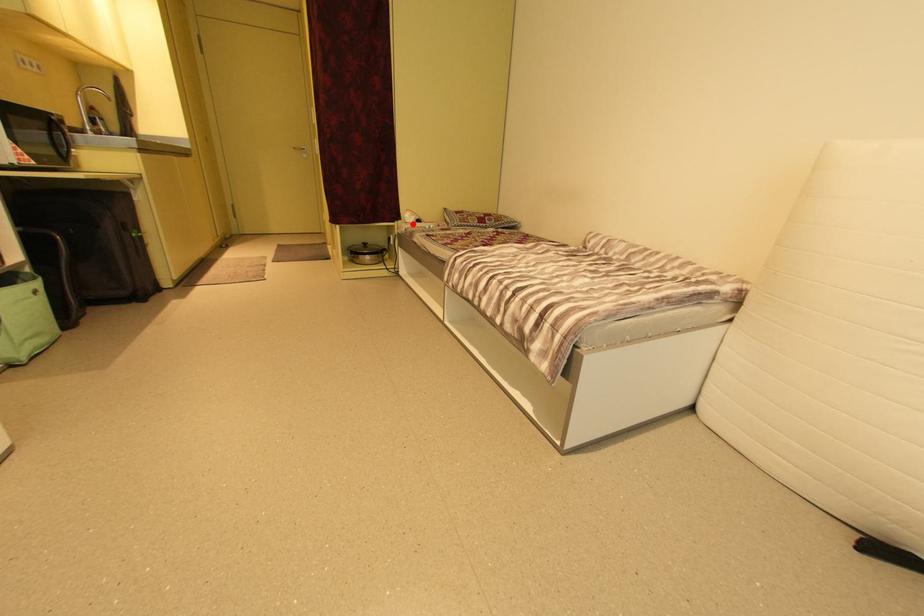
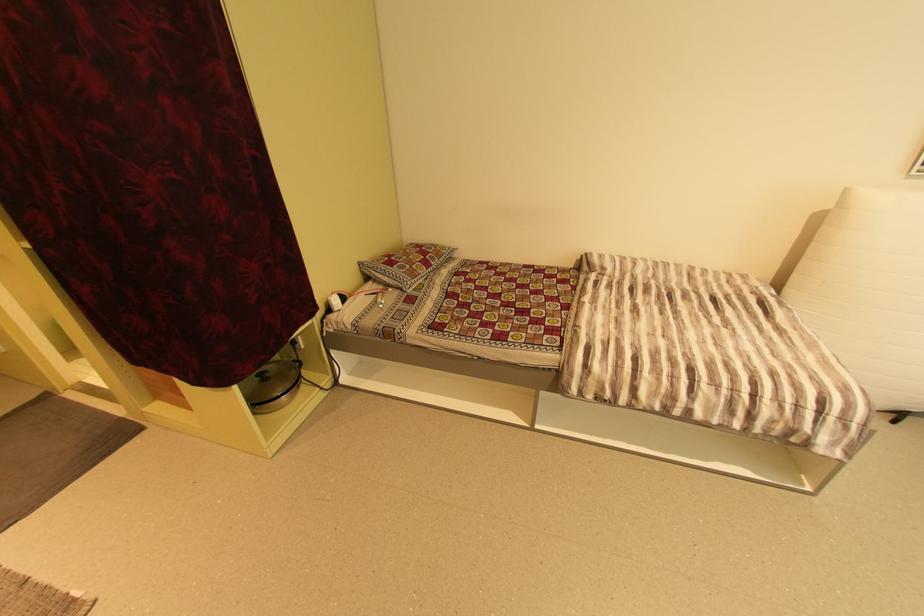
In the second image, find the point that corresponds to the highlighted location in the first image.

(335, 310)